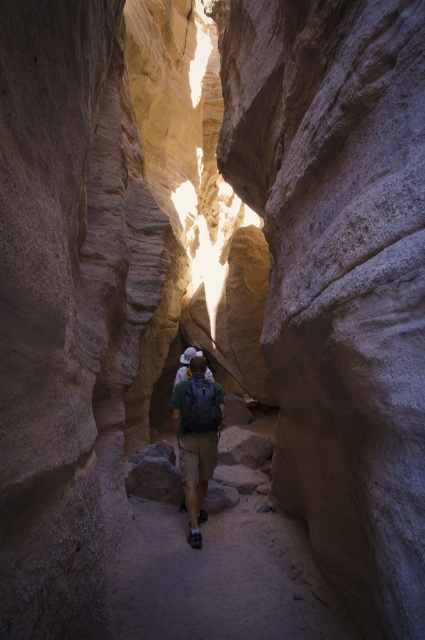
Question: Which point is farther to the camera?

Choices:
 (A) green fabric backpack at center
 (B) brown dirt path at center

Answer: (A)

Question: Is brown dirt path at center positioned behind green fabric backpack at center?

Choices:
 (A) no
 (B) yes

Answer: (A)

Question: Is brown dirt path at center in front of green fabric backpack at center?

Choices:
 (A) yes
 (B) no

Answer: (A)

Question: Where is brown dirt path at center located in relation to green fabric backpack at center in the image?

Choices:
 (A) above
 (B) below

Answer: (B)